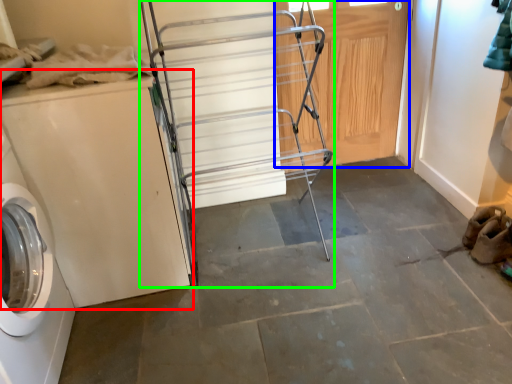
Question: Which object is positioned farthest from washing machine (highlighted by a red box)? Select from door (highlighted by a blue box) and cart (highlighted by a green box).

Choices:
 (A) door
 (B) cart

Answer: (A)